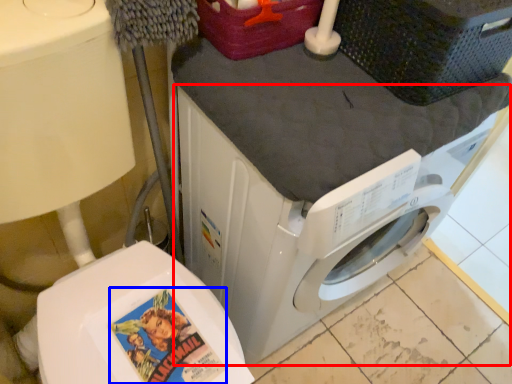
Question: Which point is further to the camera, washing machine (highlighted by a red box) or comic book character (highlighted by a blue box)?

Choices:
 (A) washing machine
 (B) comic book character

Answer: (B)